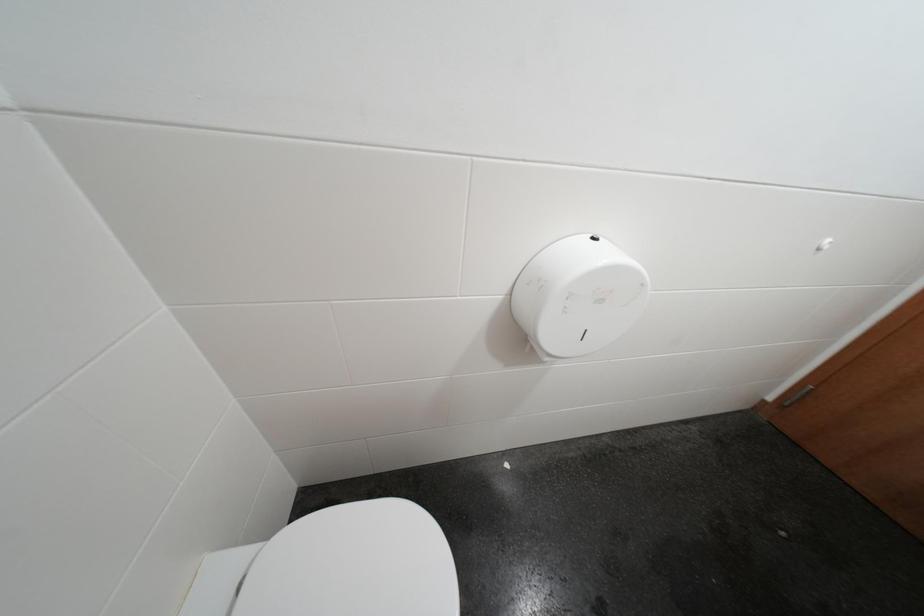
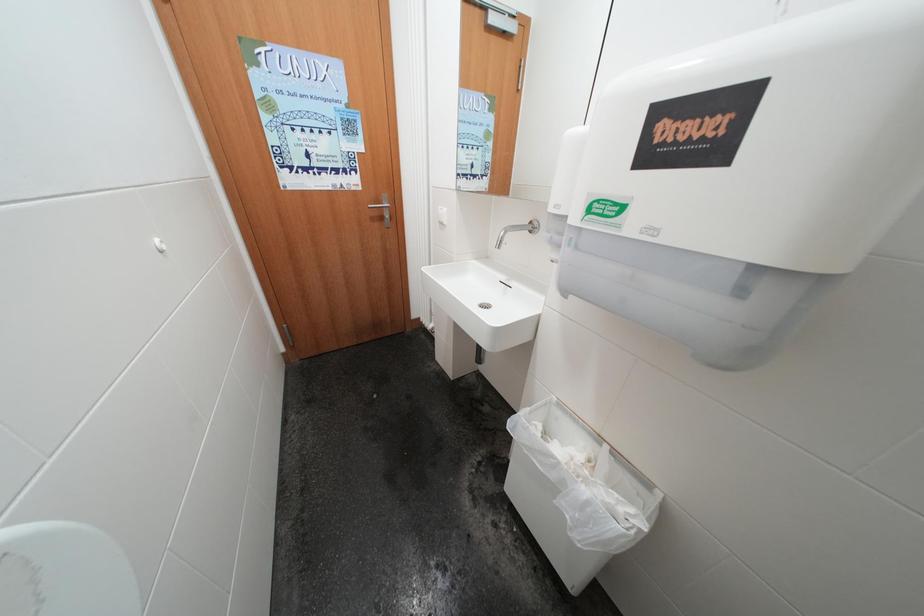
The first image is from the beginning of the video and the second image is from the end. How did the camera likely rotate when shooting the video?

The camera rotated toward right-down.